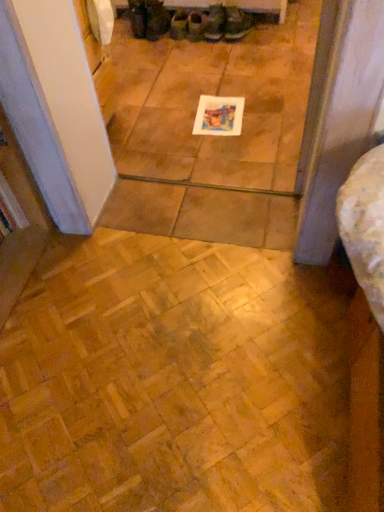
Question: Considering the relative sizes of green fabric shoe at upper center, positioned as the 1th footwear in right-to-left order, and dark brown leather boot at upper center, the 2th footwear in the left-to-right sequence, in the image provided, is green fabric shoe at upper center, positioned as the 1th footwear in right-to-left order, smaller than dark brown leather boot at upper center, the 2th footwear in the left-to-right sequence,?

Choices:
 (A) no
 (B) yes

Answer: (B)

Question: Is green fabric shoe at upper center, positioned as the 1th footwear in right-to-left order, at the left side of dark brown leather boot at upper center, which appears as the fifth footwear when viewed from the right?

Choices:
 (A) yes
 (B) no

Answer: (B)

Question: Can you confirm if green fabric shoe at upper center, the sixth footwear viewed from the left, is taller than dark brown leather boot at upper center, which appears as the fifth footwear when viewed from the right?

Choices:
 (A) yes
 (B) no

Answer: (B)

Question: Could you tell me if green fabric shoe at upper center, the sixth footwear viewed from the left, is turned towards dark brown leather boot at upper center, which appears as the fifth footwear when viewed from the right?

Choices:
 (A) no
 (B) yes

Answer: (A)

Question: From the image's perspective, is green fabric shoe at upper center, positioned as the 1th footwear in right-to-left order, located above dark brown leather boot at upper center, the 2th footwear in the left-to-right sequence?

Choices:
 (A) no
 (B) yes

Answer: (A)

Question: Can you confirm if green fabric shoe at upper center, the sixth footwear viewed from the left, is positioned to the right of dark brown leather boot at upper center, the 2th footwear in the left-to-right sequence?

Choices:
 (A) yes
 (B) no

Answer: (A)

Question: From a real-world perspective, is dark brown leather boot at upper center, which appears as the fifth footwear when viewed from the right, on white paper at center?

Choices:
 (A) yes
 (B) no

Answer: (A)

Question: From the image's perspective, is dark brown leather boot at upper center, the 2th footwear in the left-to-right sequence, located above white paper at center?

Choices:
 (A) no
 (B) yes

Answer: (B)

Question: Considering the relative positions of dark brown leather boot at upper center, the 2th footwear in the left-to-right sequence, and white paper at center in the image provided, is dark brown leather boot at upper center, the 2th footwear in the left-to-right sequence, to the right of white paper at center from the viewer's perspective?

Choices:
 (A) yes
 (B) no

Answer: (B)

Question: From a real-world perspective, is dark brown leather boot at upper center, the 2th footwear in the left-to-right sequence, beneath white paper at center?

Choices:
 (A) no
 (B) yes

Answer: (A)

Question: Can you confirm if dark brown leather boot at upper center, the 2th footwear in the left-to-right sequence, is wider than white paper at center?

Choices:
 (A) no
 (B) yes

Answer: (A)

Question: Is dark brown leather boot at upper center, the 2th footwear in the left-to-right sequence, bigger than white paper at center?

Choices:
 (A) no
 (B) yes

Answer: (B)

Question: Considering the relative positions of leather boot at center, the 5th footwear when ordered from left to right, and matte green fabric shoe at center, which ranks as the 3th footwear in right-to-left order, in the image provided, is leather boot at center, the 5th footwear when ordered from left to right, to the left of matte green fabric shoe at center, which ranks as the 3th footwear in right-to-left order, from the viewer's perspective?

Choices:
 (A) no
 (B) yes

Answer: (A)